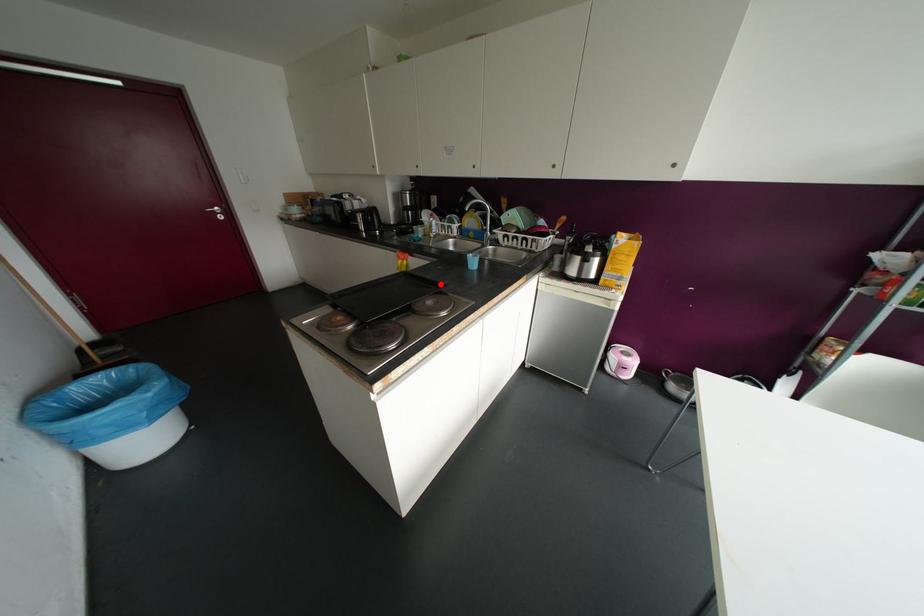
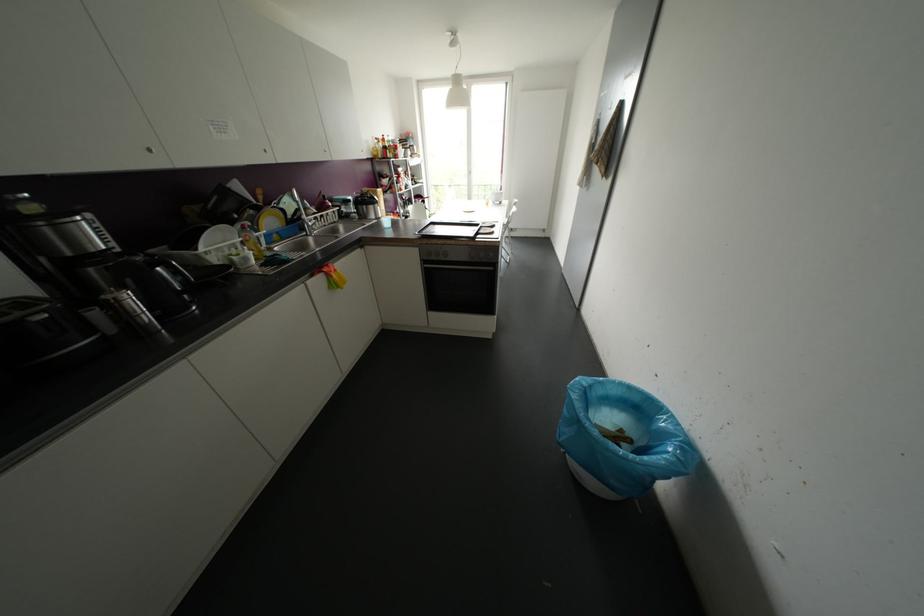
In the second image, find the point that corresponds to the highlighted location in the first image.

(432, 220)